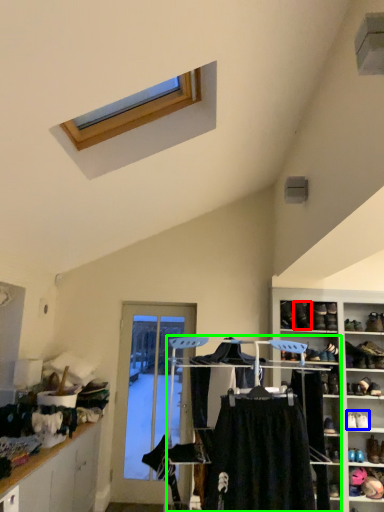
Question: Considering the real-world distances, which object is closest to shoe (highlighted by a red box)? footwear (highlighted by a blue box) or closet (highlighted by a green box).

Choices:
 (A) footwear
 (B) closet

Answer: (A)